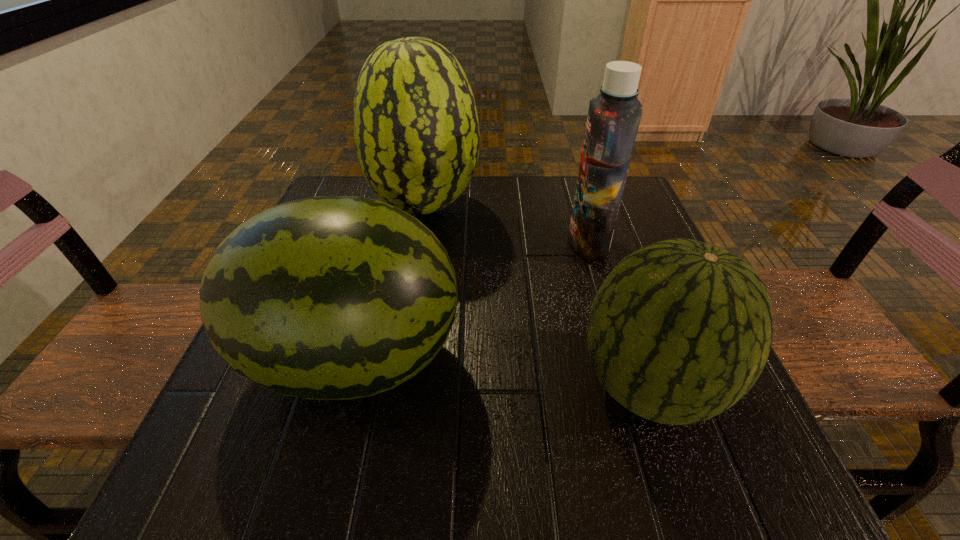
The image size is (960, 540). What are the coordinates of `free space that satisfies the following two spatial constraints: 1. on the front side of the farthest watermelon; 2. on the left side of the rightmost watermelon` in the screenshot? It's located at (395, 386).

You are a GUI agent. You are given a task and a screenshot of the screen. Output one action in this format:
    pyautogui.click(x=<x>, y=<y>)
    Task: Click on the free location that satisfies the following two spatial constraints: 1. on the front label of the rightmost watermelon; 2. on the right side of the shampoo
    This screenshot has height=540, width=960.
    Given the screenshot: What is the action you would take?
    pyautogui.click(x=632, y=386)

You are a GUI agent. You are given a task and a screenshot of the screen. Output one action in this format:
    pyautogui.click(x=<x>, y=<y>)
    Task: Click on the blank space that satisfies the following two spatial constraints: 1. on the front label of the shampoo; 2. on the back side of the rightmost watermelon
    
    Given the screenshot: What is the action you would take?
    pyautogui.click(x=632, y=386)